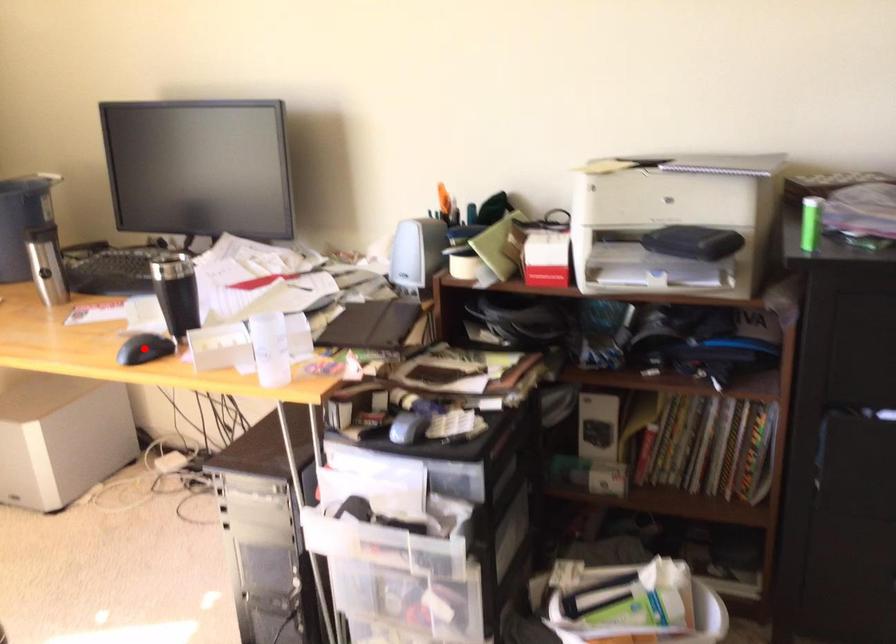
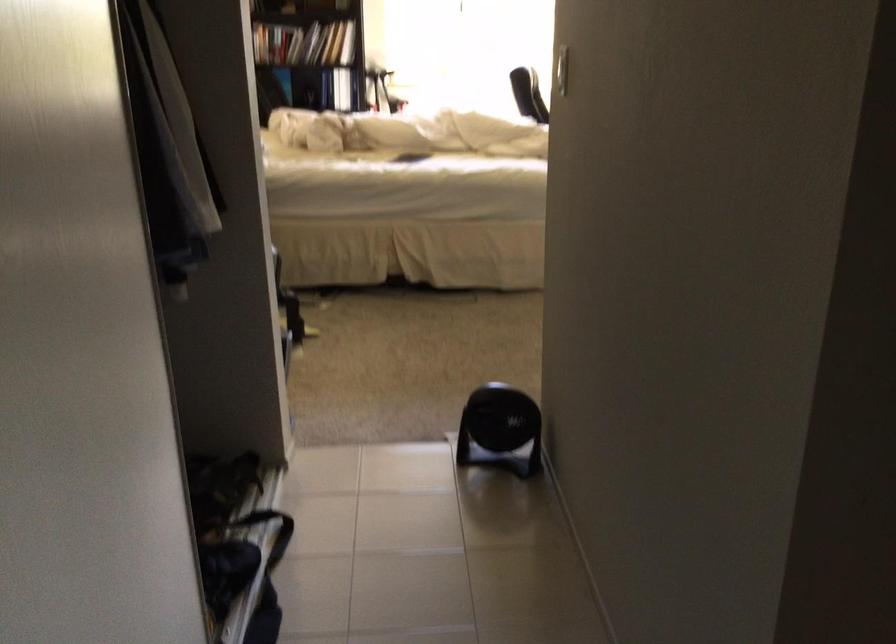
Question: I am providing you with two images of the same scene from different viewpoints. A red point is marked on the first image. Is the red point's position out of view in image 2?

Choices:
 (A) Yes
 (B) No

Answer: (A)